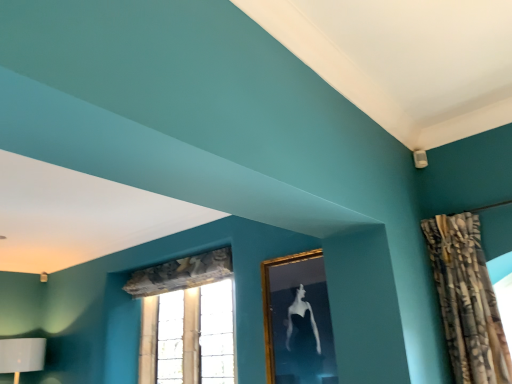
Question: Is clear glass window at center spatially inside textured beige curtain at upper right, or outside of it?

Choices:
 (A) inside
 (B) outside

Answer: (B)

Question: In the image, is clear glass window at center on the left side or the right side of textured beige curtain at upper right?

Choices:
 (A) right
 (B) left

Answer: (B)

Question: Estimate the real-world distances between objects in this image. Which object is farther from the clear glass window at center?

Choices:
 (A) textured beige curtain at upper right
 (B) gold-framed picture at upper center

Answer: (A)

Question: Estimate the real-world distances between objects in this image. Which object is farther from the textured beige curtain at upper right?

Choices:
 (A) clear glass window at center
 (B) gold-framed picture at upper center

Answer: (A)